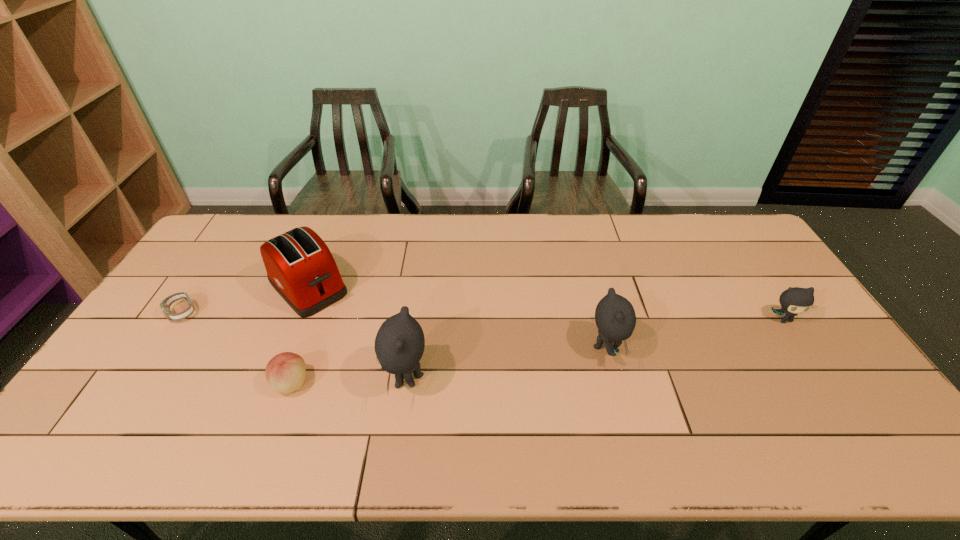
Locate an element on the screen. Image resolution: width=960 pixels, height=540 pixels. empty space between the rightmost object and the toaster is located at coordinates (546, 303).

Image resolution: width=960 pixels, height=540 pixels. I want to click on free point between the toaster and the leftmost kitten, so click(357, 333).

I want to click on empty space between the peach and the shortest object, so click(237, 348).

This screenshot has height=540, width=960. I want to click on object that is the fourth closest to the toaster, so click(615, 318).

Where is `the second closest object to the watch`? the second closest object to the watch is located at coordinates (285, 372).

The image size is (960, 540). Identify the location of the second closest kitten to the leftmost kitten. tap(796, 300).

The image size is (960, 540). What are the coordinates of `kitten that is the third closest to the leftmost object` in the screenshot? It's located at (796, 300).

At what (x,y) coordinates should I click in order to perform the action: click on free space that satisfies the following two spatial constraints: 1. on the front-facing side of the leftmost kitten; 2. on the front side of the second shortest object. Please return your answer as a coordinate pair (x, y). The image size is (960, 540). Looking at the image, I should click on (406, 383).

Where is `free space that satisfies the following two spatial constraints: 1. on the face of the shortest object; 2. on the right side of the fifth tallest object`? The image size is (960, 540). free space that satisfies the following two spatial constraints: 1. on the face of the shortest object; 2. on the right side of the fifth tallest object is located at coordinates (136, 383).

The image size is (960, 540). What are the coordinates of `vacant position in the image that satisfies the following two spatial constraints: 1. on the face of the leftmost object; 2. on the right side of the peach` in the screenshot? It's located at (136, 383).